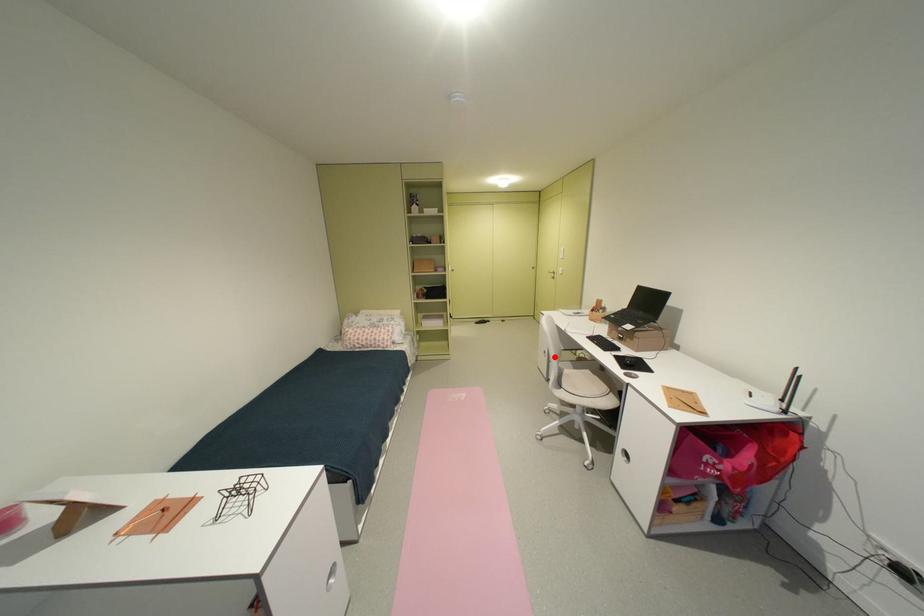
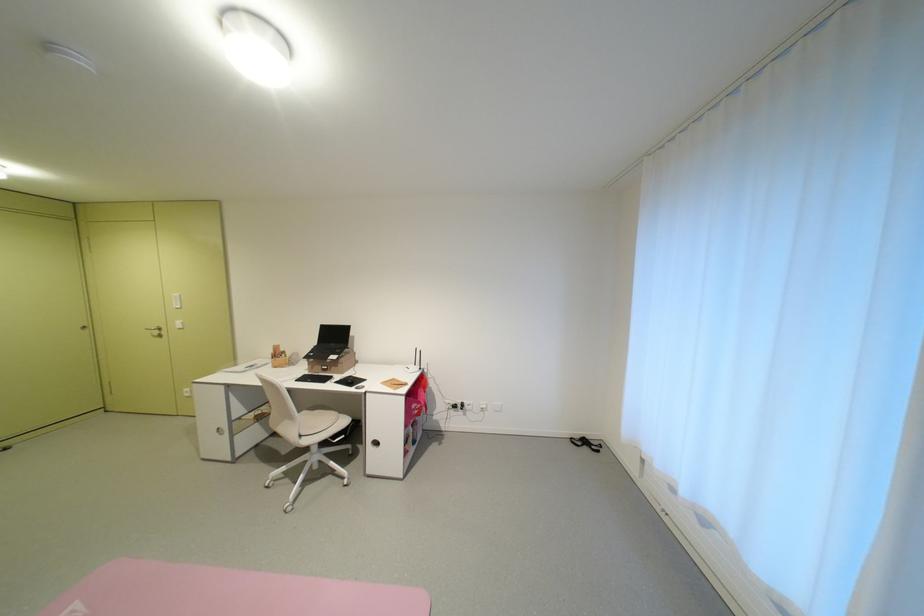
Find the pixel in the second image that matches the highlighted location in the first image.

(232, 435)